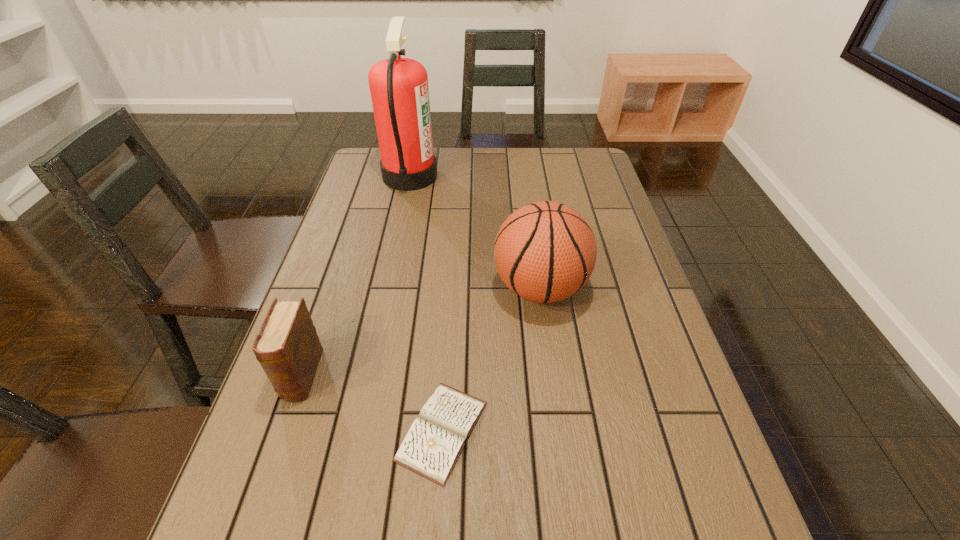
I want to click on vacant region between the tallest object and the third shortest object, so click(475, 232).

This screenshot has height=540, width=960. Find the location of `vacant point located between the tallest object and the third nearest object`. vacant point located between the tallest object and the third nearest object is located at coordinates (475, 232).

The width and height of the screenshot is (960, 540). I want to click on empty location between the rightmost object and the fire extinguisher, so click(x=475, y=232).

Locate an element on the screen. This screenshot has width=960, height=540. free spot between the tallest object and the rightmost object is located at coordinates (475, 232).

This screenshot has height=540, width=960. In order to click on object that can be found as the closest to the shortest object in this screenshot , I will do `click(545, 251)`.

Image resolution: width=960 pixels, height=540 pixels. What are the coordinates of `the second closest object to the third tallest object` in the screenshot? It's located at (545, 251).

Image resolution: width=960 pixels, height=540 pixels. What are the coordinates of `free space in the image that satisfies the following two spatial constraints: 1. on the spine side of the left diary; 2. on the left side of the shortest object` in the screenshot? It's located at (283, 431).

The image size is (960, 540). What are the coordinates of `free region that satisfies the following two spatial constraints: 1. on the side where the inflation valve is located; 2. on the spine side of the leftmost object` in the screenshot? It's located at (552, 375).

Locate an element on the screen. free space that satisfies the following two spatial constraints: 1. on the side where the inflation valve is located; 2. on the spine side of the left diary is located at coordinates [x=552, y=375].

You are a GUI agent. You are given a task and a screenshot of the screen. Output one action in this format:
    pyautogui.click(x=<x>, y=<y>)
    Task: Click on the free space that satisfies the following two spatial constraints: 1. on the spine side of the leftmost object; 2. on the right side of the right diary
    The height and width of the screenshot is (540, 960).
    Given the screenshot: What is the action you would take?
    pyautogui.click(x=283, y=431)